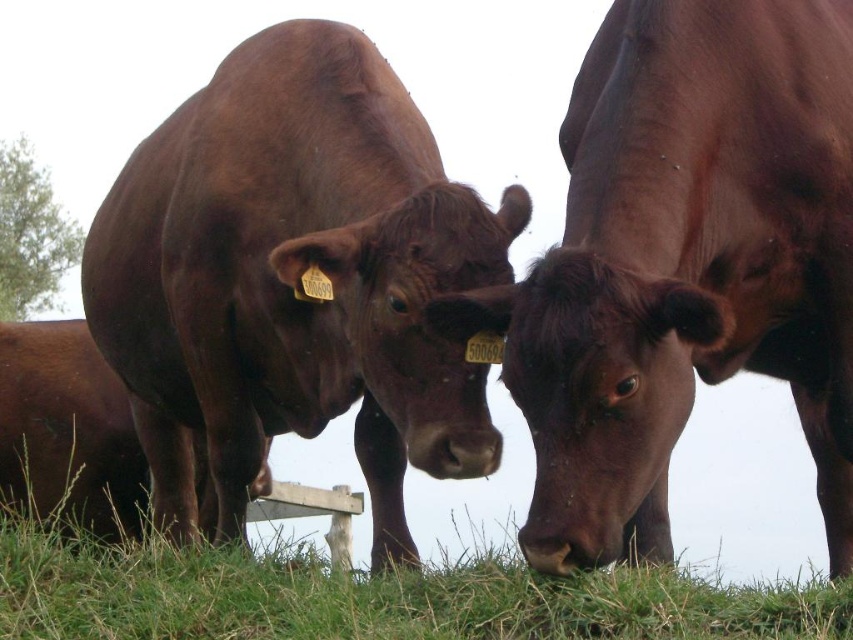
Is point (596, 458) closer to viewer compared to point (195, 264)?

Yes.

Is shiny brown cow at center thinner than shiny brown bull at center?

Indeed, shiny brown cow at center has a lesser width compared to shiny brown bull at center.

Is point (746, 252) positioned after point (149, 173)?

No, (746, 252) is closer to viewer.

The width and height of the screenshot is (853, 640). I want to click on shiny brown cow at center, so click(x=683, y=264).

Is shiny brown bull at center below green grass at lower center?

Actually, shiny brown bull at center is above green grass at lower center.

Where is `shiny brown bull at center`? The width and height of the screenshot is (853, 640). shiny brown bull at center is located at coordinates (294, 282).

Where is `shiny brown bull at center`? This screenshot has width=853, height=640. shiny brown bull at center is located at coordinates (294, 282).

Is point (283, 65) less distant than point (67, 413)?

Yes, point (283, 65) is closer to viewer.

From the picture: Is shiny brown bull at center above brown matte cow at center?

Indeed, shiny brown bull at center is positioned over brown matte cow at center.

At what (x,y) coordinates should I click in order to perform the action: click on shiny brown bull at center. Please return your answer as a coordinate pair (x, y). The image size is (853, 640). Looking at the image, I should click on (294, 282).

Where is `shiny brown bull at center`? shiny brown bull at center is located at coordinates (294, 282).